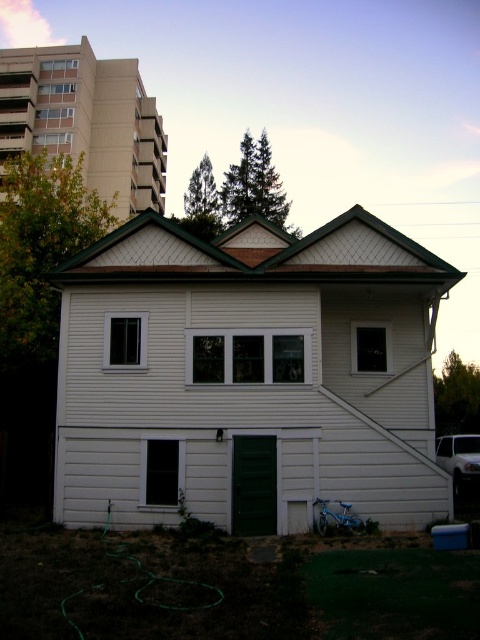
Which is above, green grass at lower left or white siding shed at upper left?

white siding shed at upper left

Is green grass at lower left smaller than white siding shed at upper left?

Yes.

Does point (357, 557) come in front of point (54, 109)?

That is True.

The height and width of the screenshot is (640, 480). Find the location of `green grass at lower left`. green grass at lower left is located at coordinates (227, 589).

Between white woodshed at center and white siding shed at upper left, which one appears on the left side from the viewer's perspective?

white siding shed at upper left

Which of these two, white woodshed at center or white siding shed at upper left, stands shorter?

white woodshed at center is shorter.

Looking at this image, who is more distant from viewer, (153, 291) or (134, 72)?

Positioned behind is point (134, 72).

Where is `white woodshed at center`? white woodshed at center is located at coordinates (249, 376).

Between white woodshed at center and green grass at lower left, which one has more height?

white woodshed at center

In the scene shown: Does white woodshed at center come in front of green grass at lower left?

That is False.

Who is more forward, (120,240) or (383,550)?

Point (383,550) is more forward.

This screenshot has width=480, height=640. Find the location of `white woodshed at center`. white woodshed at center is located at coordinates (249, 376).